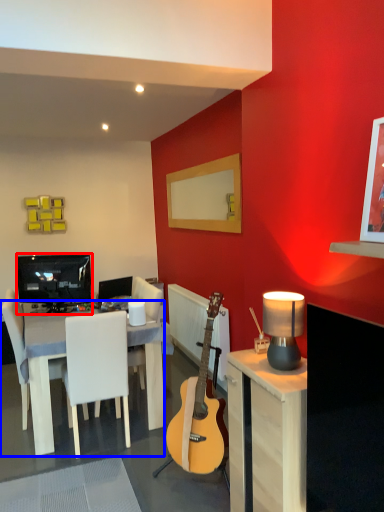
Question: Which point is closer to the camera, television (highlighted by a red box) or table (highlighted by a blue box)?

Choices:
 (A) television
 (B) table

Answer: (B)